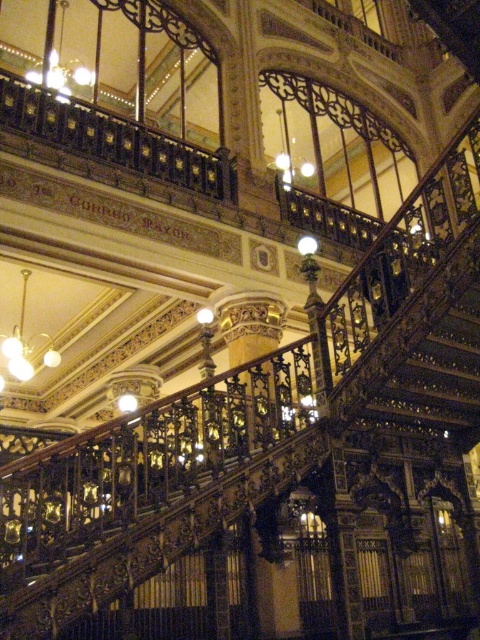
Between point (50, 58) and point (25, 273), which one is positioned in front?

Point (50, 58) is in front.

Between point (52, 77) and point (19, 371), which one is positioned behind?

Point (19, 371)

Is point (97, 19) positioned after point (22, 298)?

No, (97, 19) is in front of (22, 298).

Image resolution: width=480 pixels, height=640 pixels. Identify the location of metallic chandelier at upper left. (60, 58).